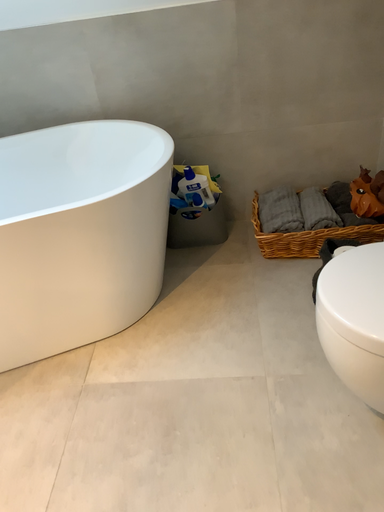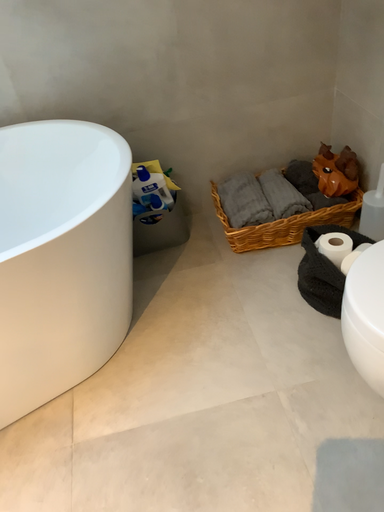
Question: How did the camera likely rotate when shooting the video?

Choices:
 (A) rotated left
 (B) rotated right

Answer: (B)